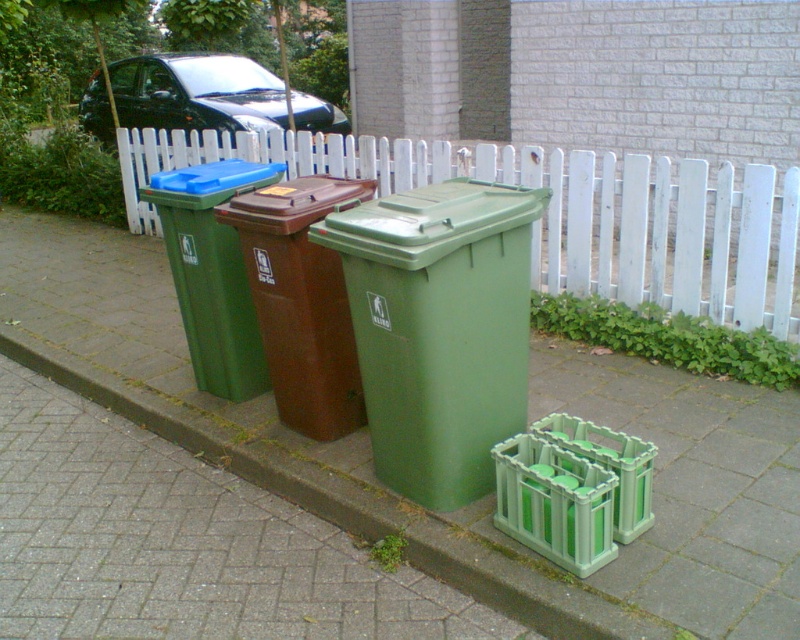
Is the position of green plastic pavement at center more distant than that of white picket fence at center?

No.

What do you see at coordinates (468, 504) in the screenshot? I see `green plastic pavement at center` at bounding box center [468, 504].

Who is more forward, (632, 616) or (345, 166)?

Positioned in front is point (632, 616).

Image resolution: width=800 pixels, height=640 pixels. In order to click on green plastic pavement at center in this screenshot , I will do `click(468, 504)`.

In the scene shown: Can you confirm if green plastic pavement at center is positioned above green matte plastic recycling bin at center?

No, green plastic pavement at center is not above green matte plastic recycling bin at center.

Does green plastic pavement at center have a greater height compared to green matte plastic recycling bin at center?

In fact, green plastic pavement at center may be shorter than green matte plastic recycling bin at center.

You are a GUI agent. You are given a task and a screenshot of the screen. Output one action in this format:
    pyautogui.click(x=<x>, y=<y>)
    Task: Click on the green plastic pavement at center
    The width and height of the screenshot is (800, 640).
    Given the screenshot: What is the action you would take?
    pyautogui.click(x=468, y=504)

Can you confirm if green matte plastic recycling bin at center is positioned above green matte plastic recycling bin at left?

No, green matte plastic recycling bin at center is not above green matte plastic recycling bin at left.

Does green matte plastic recycling bin at center appear on the left side of green matte plastic recycling bin at left?

In fact, green matte plastic recycling bin at center is to the right of green matte plastic recycling bin at left.

This screenshot has height=640, width=800. Find the location of `green matte plastic recycling bin at center`. green matte plastic recycling bin at center is located at coordinates [440, 328].